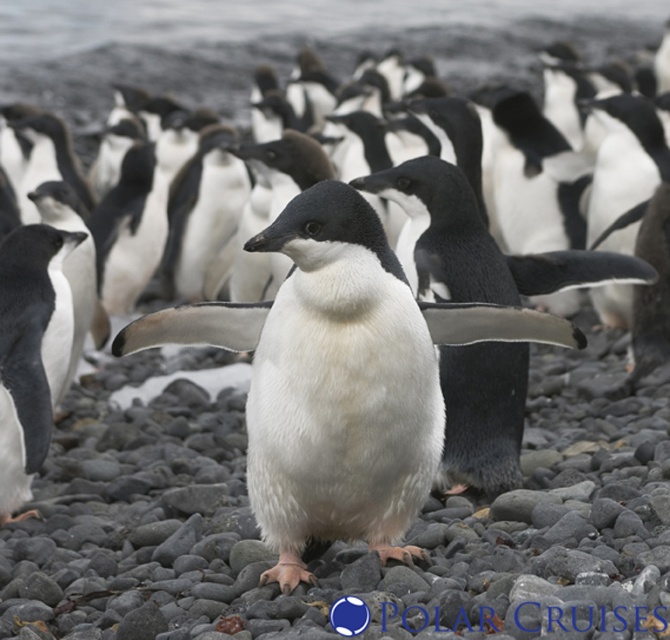
Question: Can you confirm if white matte penguin at center is positioned to the right of white matte penguin at left?

Choices:
 (A) no
 (B) yes

Answer: (B)

Question: In this image, where is white matte penguin at center located relative to white matte penguin at left?

Choices:
 (A) below
 (B) above

Answer: (A)

Question: Which of the following is the farthest from the observer?

Choices:
 (A) (50, 230)
 (B) (417, 337)

Answer: (A)

Question: Considering the relative positions of white matte penguin at center and white matte penguin at left in the image provided, where is white matte penguin at center located with respect to white matte penguin at left?

Choices:
 (A) above
 (B) below

Answer: (B)